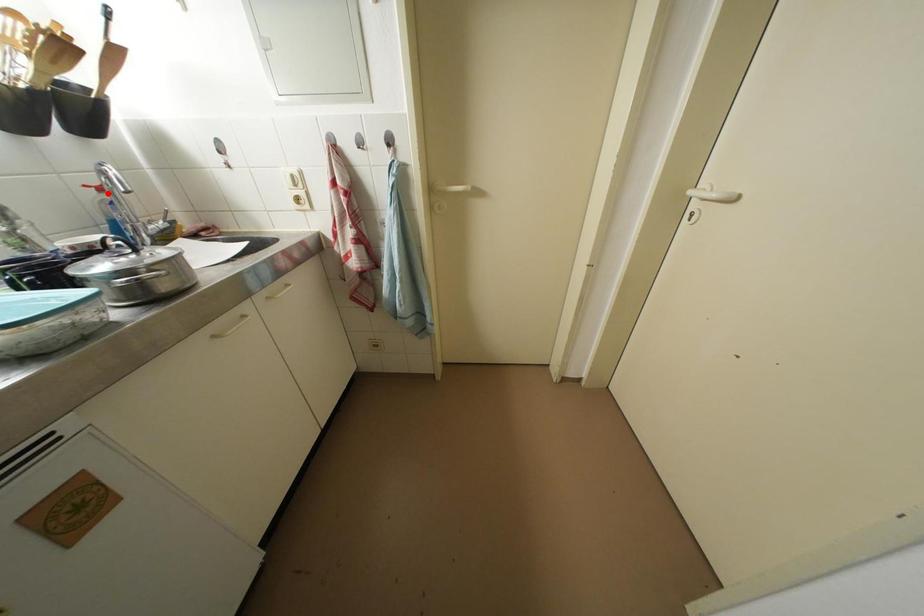
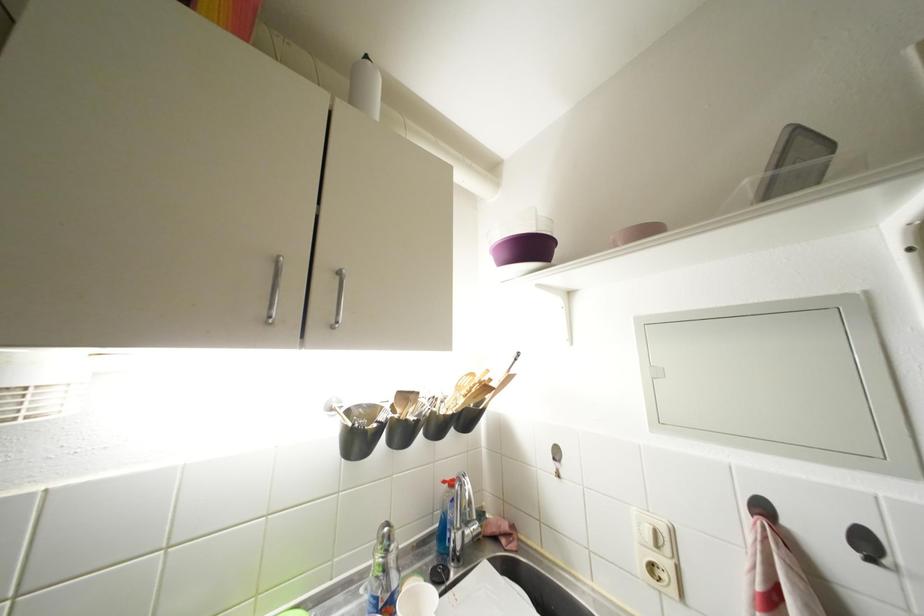
In the second image, find the point that corresponds to the highlighted location in the first image.

(457, 488)